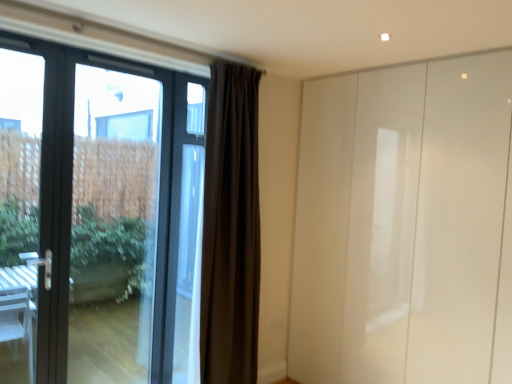
Question: Would you say matte black door at left is a long distance from dark matte curtain at center?

Choices:
 (A) yes
 (B) no

Answer: (A)

Question: Is dark matte curtain at center surrounded by matte black door at left?

Choices:
 (A) no
 (B) yes

Answer: (A)

Question: Is matte black door at left turned away from dark matte curtain at center?

Choices:
 (A) no
 (B) yes

Answer: (A)

Question: Considering the relative sizes of matte black door at left and dark matte curtain at center in the image provided, is matte black door at left wider than dark matte curtain at center?

Choices:
 (A) no
 (B) yes

Answer: (B)

Question: Is matte black door at left smaller than dark matte curtain at center?

Choices:
 (A) yes
 (B) no

Answer: (B)

Question: Looking at their shapes, would you say matte black door at left is wider or thinner than dark matte curtain at center?

Choices:
 (A) thin
 (B) wide

Answer: (B)

Question: Is matte black door at left in front of or behind dark matte curtain at center in the image?

Choices:
 (A) front
 (B) behind

Answer: (A)

Question: From a real-world perspective, relative to dark matte curtain at center, is matte black door at left vertically above or below?

Choices:
 (A) below
 (B) above

Answer: (A)

Question: From the image's perspective, is matte black door at left located above or below dark matte curtain at center?

Choices:
 (A) above
 (B) below

Answer: (A)

Question: Considering the positions of glossy white wardrobe at right and transparent glass door at left in the image, is glossy white wardrobe at right bigger or smaller than transparent glass door at left?

Choices:
 (A) small
 (B) big

Answer: (B)

Question: Would you say glossy white wardrobe at right is to the left or to the right of transparent glass door at left in the picture?

Choices:
 (A) left
 (B) right

Answer: (B)

Question: Is glossy white wardrobe at right inside the boundaries of transparent glass door at left, or outside?

Choices:
 (A) inside
 (B) outside

Answer: (B)

Question: In terms of height, does glossy white wardrobe at right look taller or shorter compared to transparent glass door at left?

Choices:
 (A) short
 (B) tall

Answer: (B)

Question: In terms of height, does dark matte curtain at center look taller or shorter compared to transparent glass door at left?

Choices:
 (A) short
 (B) tall

Answer: (B)

Question: Is dark matte curtain at center inside the boundaries of transparent glass door at left, or outside?

Choices:
 (A) outside
 (B) inside

Answer: (A)